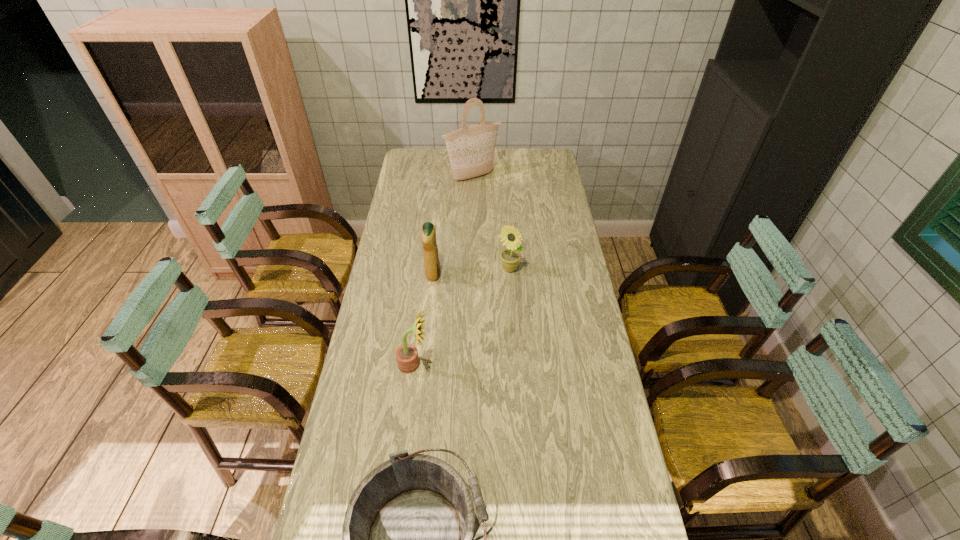
At what (x,y) coordinates should I click in order to perform the action: click on object positioned at the far edge. Please return your answer as a coordinate pair (x, y). This screenshot has height=540, width=960. Looking at the image, I should click on (471, 149).

Where is `object present at the left edge`? This screenshot has height=540, width=960. object present at the left edge is located at coordinates (407, 358).

In the image, there is a desktop. At what (x,y) coordinates should I click in order to perform the action: click on vacant space at the left edge. Please return your answer as a coordinate pair (x, y). Looking at the image, I should click on (409, 309).

Find the location of a particular element. This screenshot has height=540, width=960. vacant space at the right edge is located at coordinates (614, 465).

The image size is (960, 540). Find the location of `vacant space at the far left corner of the desktop`. vacant space at the far left corner of the desktop is located at coordinates (424, 156).

Locate an element on the screen. vacant area between the farthest object and the detergent is located at coordinates (453, 226).

Find the location of `vacant region between the farthest object and the left sunflower`. vacant region between the farthest object and the left sunflower is located at coordinates (444, 271).

At what (x,y) coordinates should I click in order to perform the action: click on vacant area that lies between the right sunflower and the tallest object. Please return your answer as a coordinate pair (x, y). Looking at the image, I should click on (491, 223).

Locate an element on the screen. This screenshot has height=540, width=960. free space between the right sunflower and the second nearest object is located at coordinates (462, 316).

Choose which object is the fourth nearest neighbor to the farthest object. Please provide its 2D coordinates. Your answer should be formatted as a tuple, i.e. [(x, y)], where the tuple contains the x and y coordinates of a point satisfying the conditions above.

[(407, 534)]